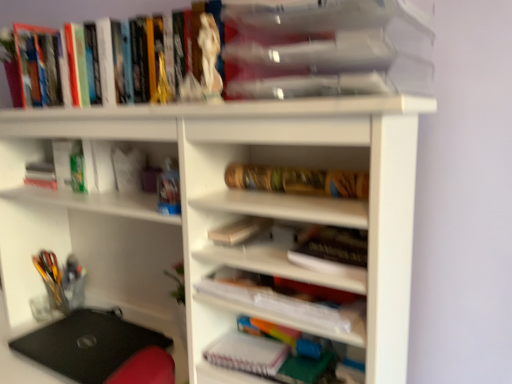
Question: From a real-world perspective, does black matte laptop at lower left stand above wooden notebook at center-right, placed as the second book when sorted from bottom to top?

Choices:
 (A) no
 (B) yes

Answer: (A)

Question: Can we say black matte laptop at lower left lies outside wooden notebook at center-right, arranged as the 5th book when viewed from the top?

Choices:
 (A) yes
 (B) no

Answer: (A)

Question: Is wooden notebook at center-right, placed as the second book when sorted from bottom to top, inside black matte laptop at lower left?

Choices:
 (A) yes
 (B) no

Answer: (B)

Question: Can you confirm if black matte laptop at lower left is positioned to the left of wooden notebook at center-right, arranged as the 5th book when viewed from the top?

Choices:
 (A) yes
 (B) no

Answer: (A)

Question: Considering the relative sizes of black matte laptop at lower left and wooden notebook at center-right, placed as the second book when sorted from bottom to top, in the image provided, is black matte laptop at lower left smaller than wooden notebook at center-right, placed as the second book when sorted from bottom to top,?

Choices:
 (A) yes
 (B) no

Answer: (B)

Question: From the image's perspective, is black matte laptop at lower left on top of wooden notebook at center-right, arranged as the 5th book when viewed from the top?

Choices:
 (A) no
 (B) yes

Answer: (A)

Question: Would you say white matte notebook at lower center contains clear plastic container at upper center, which is counted as the fifth book, starting from the bottom?

Choices:
 (A) yes
 (B) no

Answer: (B)

Question: Considering the relative positions of white matte notebook at lower center and clear plastic container at upper center, which is counted as the fifth book, starting from the bottom, in the image provided, is white matte notebook at lower center to the left of clear plastic container at upper center, which is counted as the fifth book, starting from the bottom, from the viewer's perspective?

Choices:
 (A) no
 (B) yes

Answer: (B)

Question: Considering the relative sizes of white matte notebook at lower center and clear plastic container at upper center, which is counted as the fifth book, starting from the bottom, in the image provided, is white matte notebook at lower center bigger than clear plastic container at upper center, which is counted as the fifth book, starting from the bottom,?

Choices:
 (A) yes
 (B) no

Answer: (B)

Question: Is white matte notebook at lower center at the right side of clear plastic container at upper center, marked as the second book in a top-to-bottom arrangement?

Choices:
 (A) yes
 (B) no

Answer: (B)

Question: From the image's perspective, is white matte notebook at lower center on top of clear plastic container at upper center, which is counted as the fifth book, starting from the bottom?

Choices:
 (A) no
 (B) yes

Answer: (A)

Question: From a real-world perspective, is white matte notebook at lower center on clear plastic container at upper center, which is counted as the fifth book, starting from the bottom?

Choices:
 (A) no
 (B) yes

Answer: (A)

Question: From the image's perspective, would you say hardcover books at upper left, marked as the 1th book in a top-to-bottom arrangement, is shown under wooden notebook at center-right, placed as the second book when sorted from bottom to top?

Choices:
 (A) no
 (B) yes

Answer: (A)